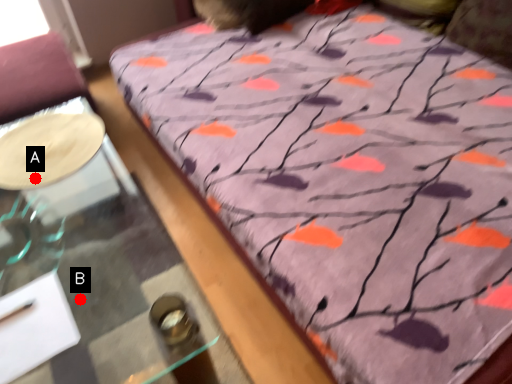
Question: Two points are circled on the image, labeled by A and B beside each circle. Which point is further to the camera?

Choices:
 (A) A is further
 (B) B is further

Answer: (B)